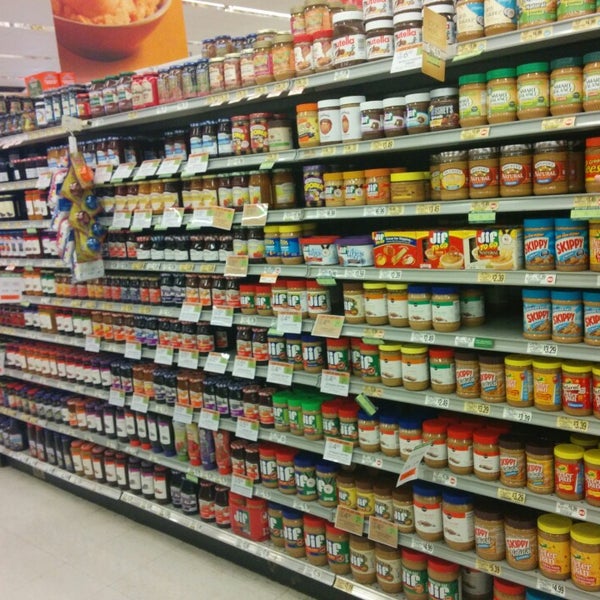
Find the location of a particular element. light is located at coordinates (261, 16), (32, 53).